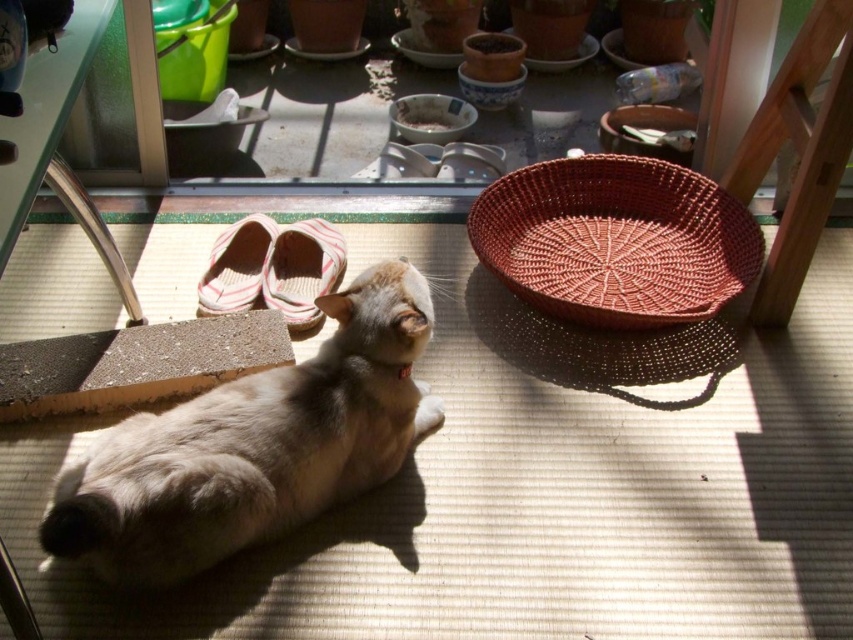
The height and width of the screenshot is (640, 853). Describe the element at coordinates (616, 240) in the screenshot. I see `brown woven basket at lower right` at that location.

Who is higher up, brown woven basket at lower right or striped fabric slipper at lower left?

Positioned higher is brown woven basket at lower right.

Where is `brown woven basket at lower right`? This screenshot has height=640, width=853. brown woven basket at lower right is located at coordinates (616, 240).

Find the location of `brown woven basket at lower right`. brown woven basket at lower right is located at coordinates (616, 240).

Who is more distant from viewer, (x=308, y=266) or (x=242, y=236)?

The point (x=242, y=236) is behind.

Measure the distance between point (326, 275) and camera.

The distance of point (326, 275) from camera is 2.39 meters.

This screenshot has width=853, height=640. Identify the location of striped fabric shoe at center. (302, 269).

Identify the location of striped fabric shoe at center. Image resolution: width=853 pixels, height=640 pixels. point(302,269).

Does point (105, 465) lie in front of point (300, 285)?

Yes, point (105, 465) is in front of point (300, 285).

Is light brown fur cat at center wider than striped fabric shoe at center?

Correct, the width of light brown fur cat at center exceeds that of striped fabric shoe at center.

The height and width of the screenshot is (640, 853). I want to click on light brown fur cat at center, so click(254, 445).

Where is `light brown fur cat at center`? light brown fur cat at center is located at coordinates (254, 445).